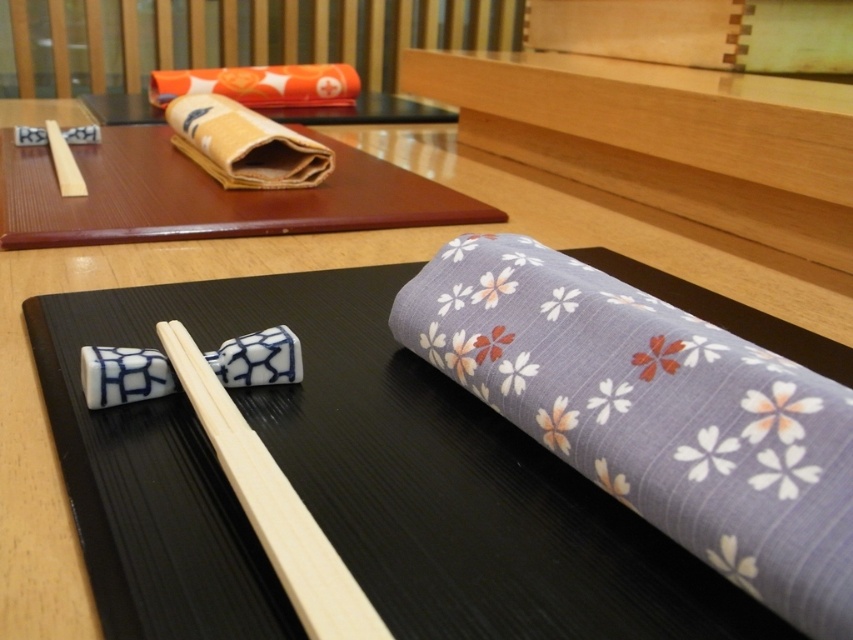
You are a server at a Japanese restaurant and need to place a new set of chopsticks on the tray. The existing chopsticks are the white glossy chopsticks at center. You have two options for the new chopsticks. One is the beige fabric at upper left, and the other is a thicker pair. Which option would match the existing setup better?

The beige fabric at upper left is thinner than the white glossy chopsticks at center, so the thicker pair would match the existing setup better since the current chopsticks are thinner.

You are a customer at a Japanese restaurant and want to reach both the point at coordinate (45, 240) and the point at coordinate (248, 376). Which point is closer to you?

The point at coordinate (45, 240) is closer to you because it is further to the viewer than the point at coordinate (248, 376).

You are a customer at a sushi restaurant and want to reach both the white glossy chopsticks at center and the beige fabric at upper left. Which object is closer to you?

The white glossy chopsticks at center are closer to the viewer than the beige fabric at upper left.